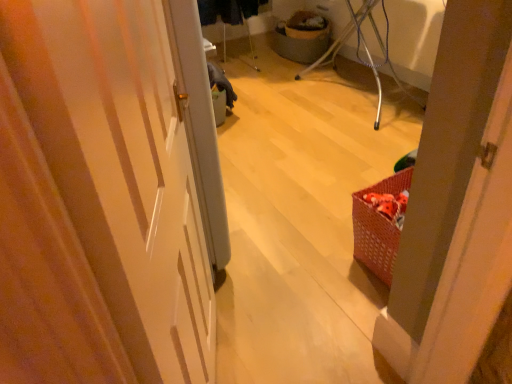
Question: Should I look upward or downward to see matte gray basket at center?

Choices:
 (A) up
 (B) down

Answer: (A)

Question: Is matte gray basket at center shorter than white glossy door at center?

Choices:
 (A) yes
 (B) no

Answer: (A)

Question: Is matte gray basket at center smaller than white glossy door at center?

Choices:
 (A) yes
 (B) no

Answer: (A)

Question: Is matte gray basket at center at the left side of white glossy door at center?

Choices:
 (A) no
 (B) yes

Answer: (A)

Question: Considering the relative sizes of matte gray basket at center and white glossy door at center in the image provided, is matte gray basket at center taller than white glossy door at center?

Choices:
 (A) yes
 (B) no

Answer: (B)

Question: Is matte gray basket at center thinner than white glossy door at center?

Choices:
 (A) yes
 (B) no

Answer: (B)

Question: Does matte gray basket at center lie behind white glossy door at center?

Choices:
 (A) no
 (B) yes

Answer: (B)

Question: Can you confirm if white glossy door at center is thinner than matte gray basket at center?

Choices:
 (A) yes
 (B) no

Answer: (A)

Question: Would you consider white glossy door at center to be distant from matte gray basket at center?

Choices:
 (A) yes
 (B) no

Answer: (A)

Question: From a real-world perspective, is white glossy door at center on top of matte gray basket at center?

Choices:
 (A) no
 (B) yes

Answer: (B)

Question: Is white glossy door at center turned away from matte gray basket at center?

Choices:
 (A) yes
 (B) no

Answer: (B)

Question: From the image's perspective, does white glossy door at center appear higher than matte gray basket at center?

Choices:
 (A) yes
 (B) no

Answer: (B)

Question: Is white glossy door at center located outside matte gray basket at center?

Choices:
 (A) no
 (B) yes

Answer: (B)

Question: Does point (297, 61) appear closer or farther from the camera than point (12, 38)?

Choices:
 (A) closer
 (B) farther

Answer: (B)